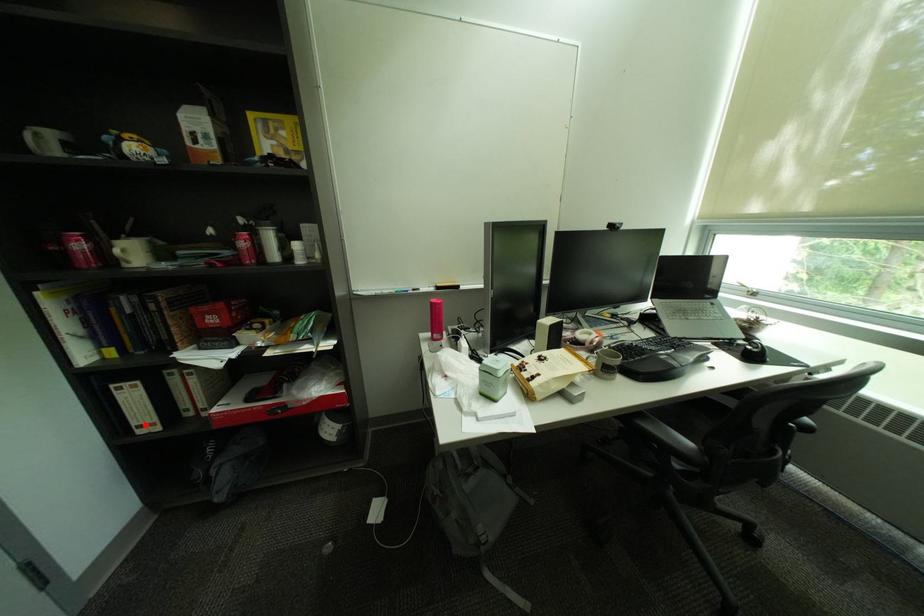
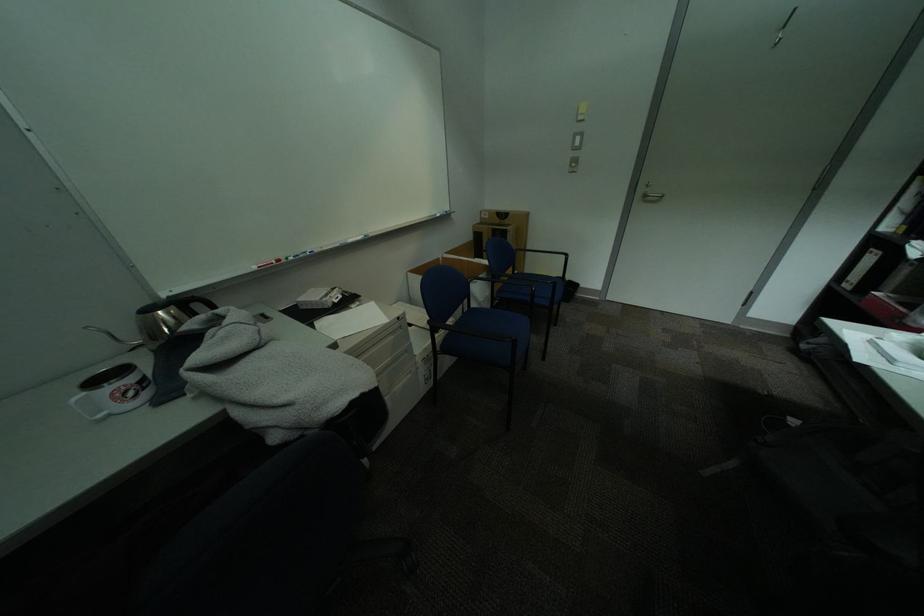
Question: A red point is marked in image1. In image2, is the corresponding 3D point closer to the camera or farther? Reply with the corresponding letter.

Choices:
 (A) The corresponding 3D point is closer.
 (B) The corresponding 3D point is farther.

Answer: (B)